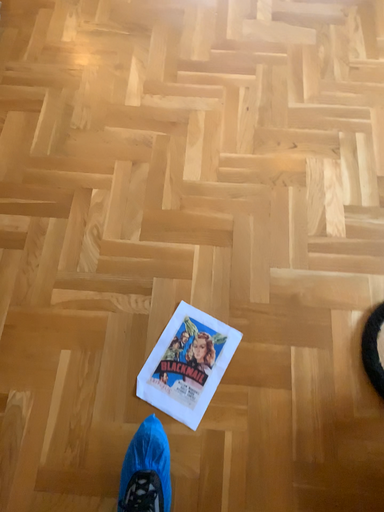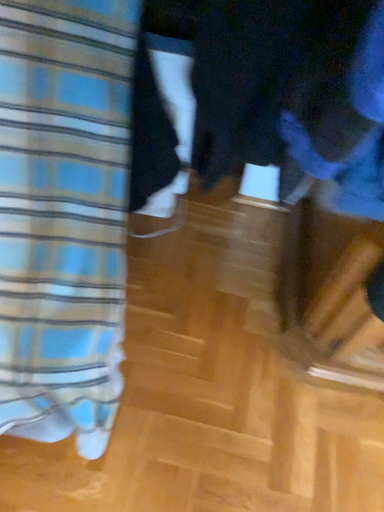
Question: How did the camera likely rotate when shooting the video?

Choices:
 (A) rotated upward
 (B) rotated downward

Answer: (A)